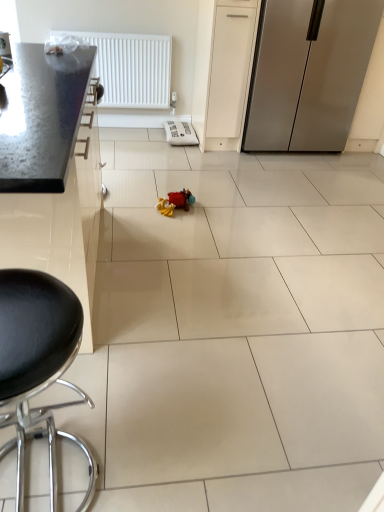
Question: Is satin silver refrigerator at right not inside black leather stool at lower left?

Choices:
 (A) yes
 (B) no

Answer: (A)

Question: Is satin silver refrigerator at right bigger than black leather stool at lower left?

Choices:
 (A) no
 (B) yes

Answer: (B)

Question: Is satin silver refrigerator at right far away from black leather stool at lower left?

Choices:
 (A) no
 (B) yes

Answer: (B)

Question: Is satin silver refrigerator at right wider than black leather stool at lower left?

Choices:
 (A) no
 (B) yes

Answer: (B)

Question: Does satin silver refrigerator at right come in front of black leather stool at lower left?

Choices:
 (A) no
 (B) yes

Answer: (A)

Question: Considering the relative sizes of satin silver refrigerator at right and black leather stool at lower left in the image provided, is satin silver refrigerator at right taller than black leather stool at lower left?

Choices:
 (A) yes
 (B) no

Answer: (A)

Question: Is soft plush toy at center not within white plastic radiator at upper left?

Choices:
 (A) yes
 (B) no

Answer: (A)

Question: From a real-world perspective, is soft plush toy at center positioned over white plastic radiator at upper left based on gravity?

Choices:
 (A) yes
 (B) no

Answer: (B)

Question: Is soft plush toy at center thinner than white plastic radiator at upper left?

Choices:
 (A) no
 (B) yes

Answer: (A)

Question: Is soft plush toy at center positioned before white plastic radiator at upper left?

Choices:
 (A) yes
 (B) no

Answer: (A)

Question: Can you confirm if soft plush toy at center is wider than white plastic radiator at upper left?

Choices:
 (A) no
 (B) yes

Answer: (B)

Question: Is soft plush toy at center at the right side of white plastic radiator at upper left?

Choices:
 (A) no
 (B) yes

Answer: (B)

Question: From the image's perspective, is metallic countertop at left below soft plush toy at center?

Choices:
 (A) no
 (B) yes

Answer: (B)